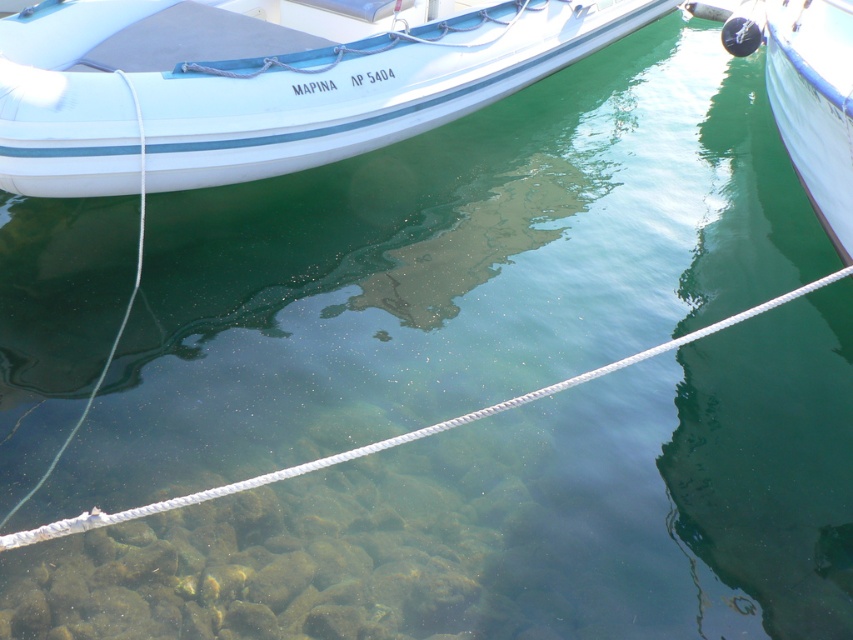
You are standing on the dock and want to secure the white matte boat at upper left to the white rope at center. The boat has a grappling hook that can reach 4 meters. Can you attach the grappling hook from the boat to the rope without moving either?

The white matte boat at upper left is 3.91 meters from the white rope at center. Since the grappling hook can reach 4 meters, it is just within range. Therefore, you can attach the grappling hook from the white matte boat at upper left to the white rope at center without moving either.

Looking at this image, you are standing at the point marked as point (262, 81). What object are you facing in the scene?

The point (262, 81) corresponds to the white matte boat at upper left, so you are facing the white matte boat at upper left.

You are a photographer taking a picture of the harbor. You notice two points marked in the image. The first point is at coordinate point (482,22) and the second is at point (751,310). Which point is closer to your camera?

Point (482,22) is closer to the camera than point (751,310) because it is further to the camera than the other point.